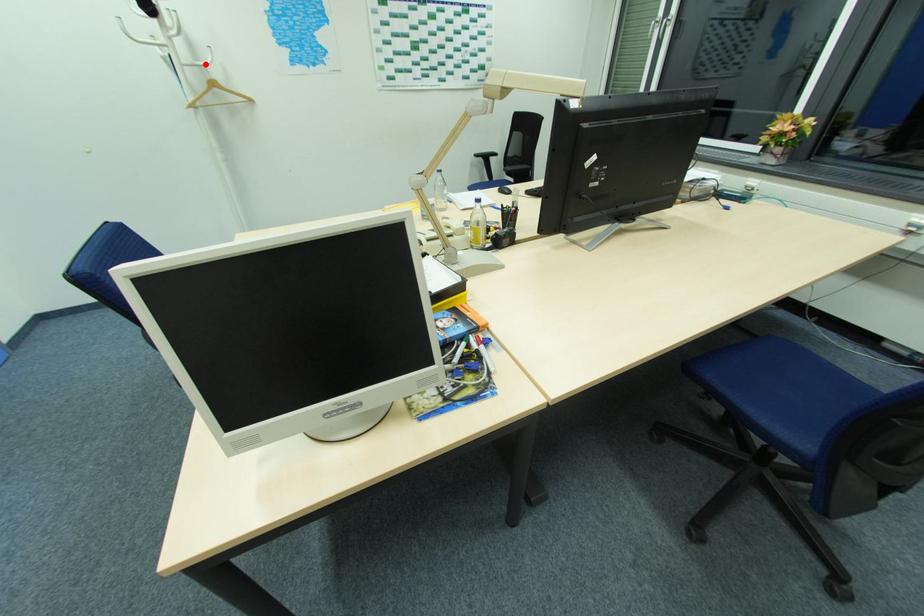
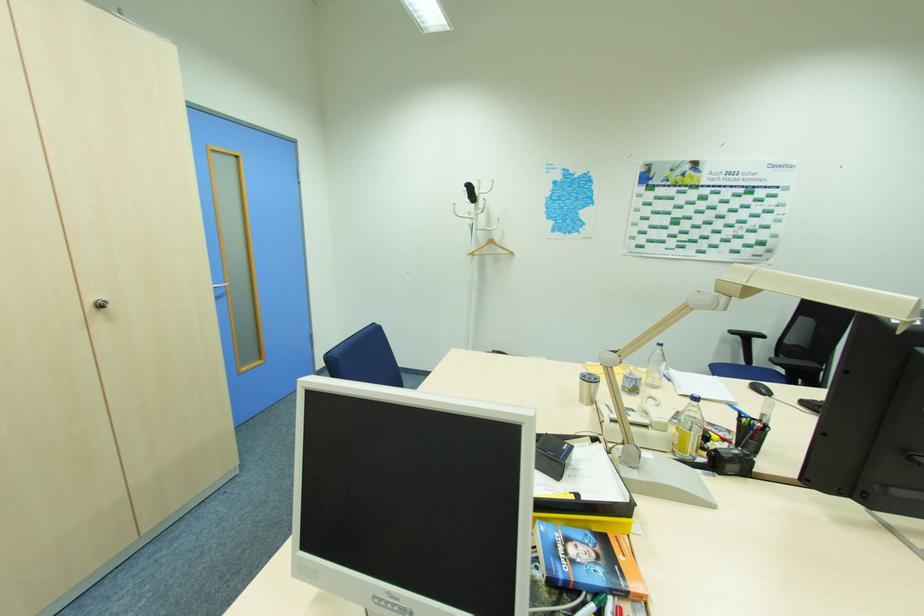
In the second image, find the point that corresponds to the highlighted location in the first image.

(492, 229)